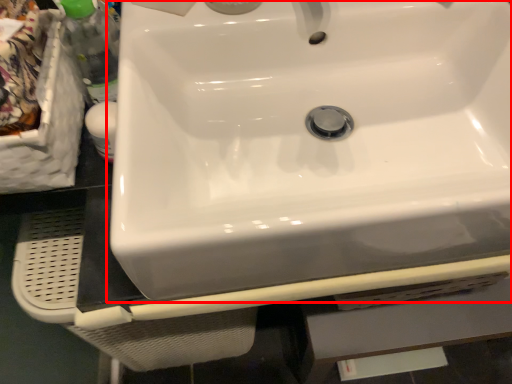
Question: From the image's perspective, considering the relative positions of sink (annotated by the red box) and bottle in the image provided, where is sink (annotated by the red box) located with respect to the staircase?

Choices:
 (A) below
 (B) above

Answer: (A)